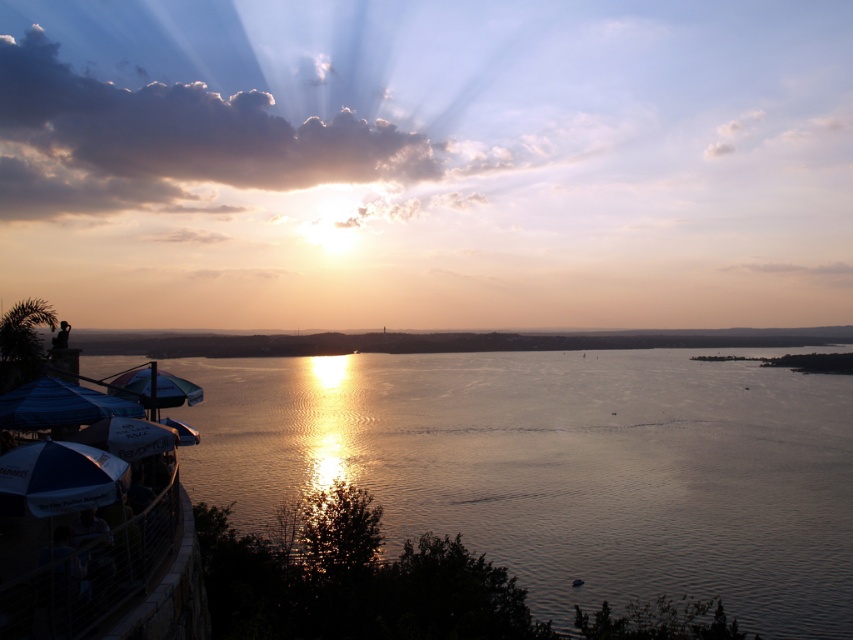
Question: Does white fabric umbrella at lower left appear under blue fabric umbrella at lower left?

Choices:
 (A) no
 (B) yes

Answer: (B)

Question: Does white fabric umbrella at lower left have a smaller size compared to blue fabric umbrella at lower left?

Choices:
 (A) no
 (B) yes

Answer: (B)

Question: Which object is the closest to the blue fabric umbrella at lower left?

Choices:
 (A) glistening water at center
 (B) white fabric umbrella at lower left

Answer: (B)

Question: Can you confirm if glistening water at center is positioned to the left of blue fabric umbrella at lower left?

Choices:
 (A) yes
 (B) no

Answer: (A)

Question: Which of the following is the farthest from the observer?

Choices:
 (A) (561, 426)
 (B) (32, 396)

Answer: (A)

Question: Which object is farther from the camera taking this photo?

Choices:
 (A) white fabric umbrella at lower left
 (B) glistening water at center

Answer: (B)